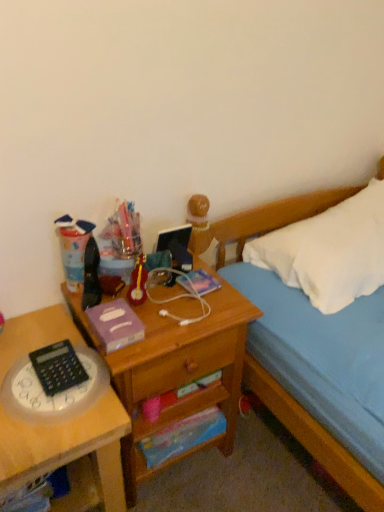
Question: Does purple matte paper at center, which is the 3th paperback book from back to front, have a larger size compared to metallic purple paperback book at center, the first paperback book in the top-to-bottom sequence?

Choices:
 (A) yes
 (B) no

Answer: (A)

Question: Could you tell me if purple matte paper at center, which is the 3th paperback book from back to front, is facing metallic purple paperback book at center, acting as the third paperback book starting from the bottom?

Choices:
 (A) yes
 (B) no

Answer: (B)

Question: Considering the relative sizes of purple matte paper at center, the 1th paperback book positioned from the front, and metallic purple paperback book at center, the first paperback book in the top-to-bottom sequence, in the image provided, is purple matte paper at center, the 1th paperback book positioned from the front, thinner than metallic purple paperback book at center, the first paperback book in the top-to-bottom sequence,?

Choices:
 (A) no
 (B) yes

Answer: (A)

Question: Is purple matte paper at center, the 1th paperback book positioned from the front, at the left side of metallic purple paperback book at center, the 2th paperback book viewed from the front?

Choices:
 (A) yes
 (B) no

Answer: (A)

Question: Is purple matte paper at center, the 1th paperback book positioned from the front, further to the viewer compared to metallic purple paperback book at center, the 2th paperback book viewed from the front?

Choices:
 (A) no
 (B) yes

Answer: (A)

Question: Based on their sizes in the image, would you say purple matte paper at center, which is the 3th paperback book from back to front, is bigger or smaller than black plastic calculator at lower left?

Choices:
 (A) big
 (B) small

Answer: (B)

Question: Is purple matte paper at center, which is the 3th paperback book from back to front, wider or thinner than black plastic calculator at lower left?

Choices:
 (A) thin
 (B) wide

Answer: (A)

Question: Is point (117, 330) positioned closer to the camera than point (54, 354)?

Choices:
 (A) farther
 (B) closer

Answer: (B)

Question: From the image's perspective, relative to black plastic calculator at lower left, is purple matte paper at center, the 1th paperback book positioned from the front, above or below?

Choices:
 (A) above
 (B) below

Answer: (A)

Question: From a real-world perspective, is white soft bed at upper right above or below wooden desk at center, the 2th desk in the left-to-right sequence?

Choices:
 (A) below
 (B) above

Answer: (B)

Question: In terms of size, does white soft bed at upper right appear bigger or smaller than wooden desk at center, arranged as the 1th desk when viewed from the right?

Choices:
 (A) big
 (B) small

Answer: (A)

Question: Is white soft bed at upper right taller or shorter than wooden desk at center, the 2th desk in the left-to-right sequence?

Choices:
 (A) short
 (B) tall

Answer: (B)

Question: Visually, is white soft bed at upper right positioned to the left or to the right of wooden desk at center, arranged as the 1th desk when viewed from the right?

Choices:
 (A) right
 (B) left

Answer: (A)

Question: Considering the positions of point (127, 342) and point (79, 401), is point (127, 342) closer or farther from the camera than point (79, 401)?

Choices:
 (A) closer
 (B) farther

Answer: (B)

Question: Considering the positions of purple matte paper at center, placed as the second paperback book when sorted from bottom to top, and translucent plastic clock at lower left in the image, is purple matte paper at center, placed as the second paperback book when sorted from bottom to top, wider or thinner than translucent plastic clock at lower left?

Choices:
 (A) thin
 (B) wide

Answer: (A)